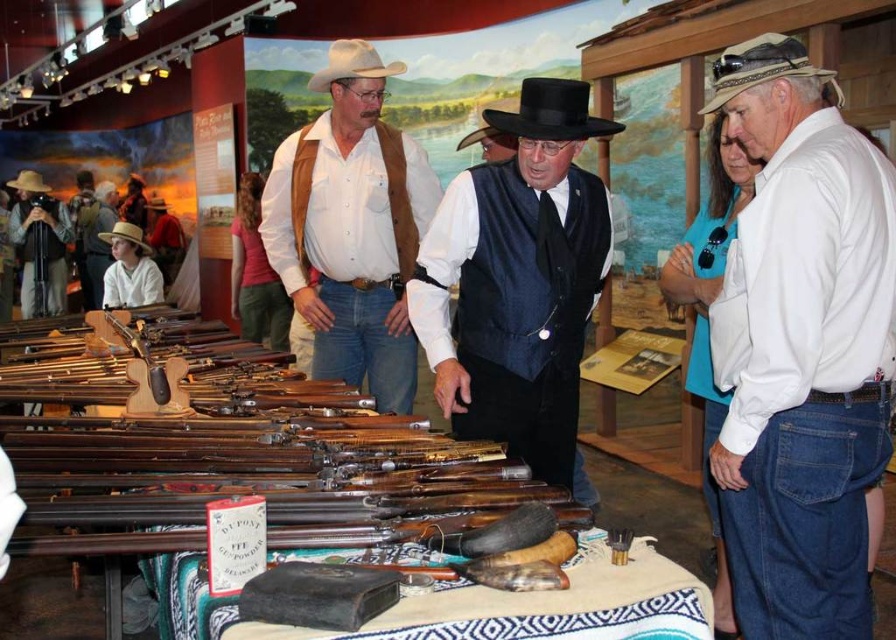
You are a photographer standing at the camera position. You want to take a closeup photo of the velvet black vest at center. Can you reach it with your camera without moving your position?

The velvet black vest at center is 2.01 meters from camera, so yes, you can take a closeup photo of the velvet black vest at center from your current position since it is within reach.

You are a costume designer observing the historical exhibit. You notice two items at the center of the display table. One is the velvet black vest at center and the other is the black felt cowboy hat at center. Which item is positioned lower on the table?

The velvet black vest at center is located below the black felt cowboy hat at center, so the velvet black vest at center is positioned lower on the table.

What is the object located at the coordinates point (800, 348) in the scene?

The object located at point (800, 348) is a white cotton shirt at upper right.